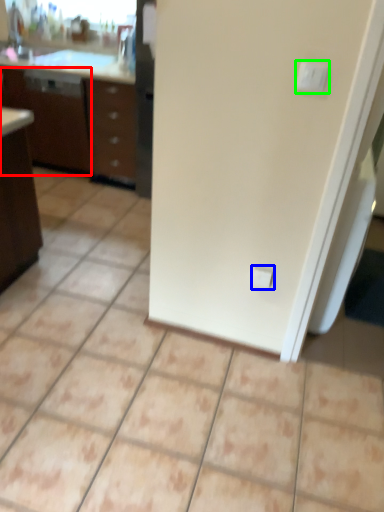
Question: Which object is the farthest from file cabinet (highlighted by a red box)? Choose among these: electric outlet (highlighted by a blue box) or light switch (highlighted by a green box).

Choices:
 (A) electric outlet
 (B) light switch

Answer: (B)